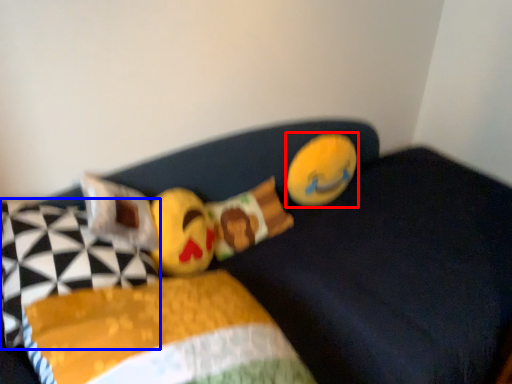
Question: Which object is closer to the camera taking this photo, toy (highlighted by a red box) or pillow (highlighted by a blue box)?

Choices:
 (A) toy
 (B) pillow

Answer: (B)